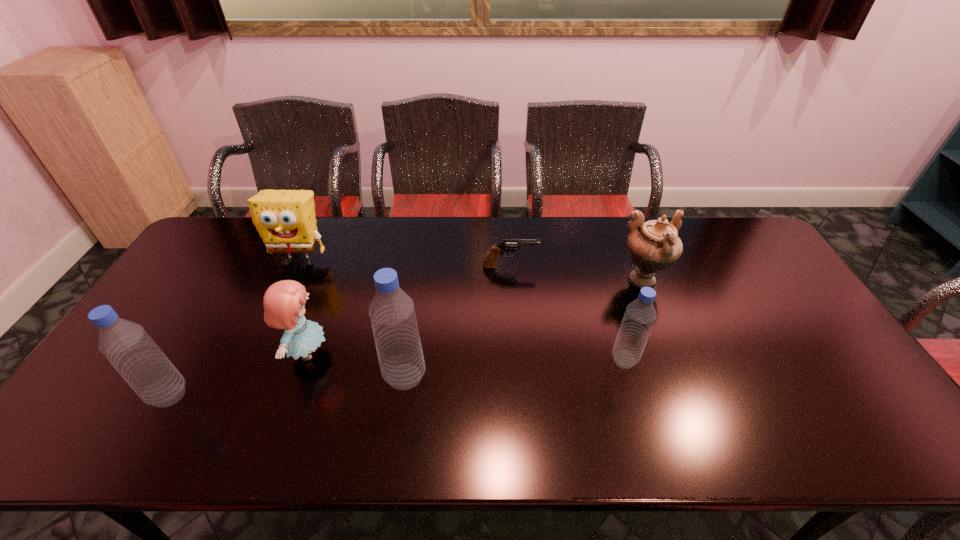
You are a GUI agent. You are given a task and a screenshot of the screen. Output one action in this format:
    pyautogui.click(x=<x>, y=<y>)
    Task: Click on the vacant space that satisfies the following two spatial constraints: 1. on the back side of the fourth object from right to left; 2. on the front-facing side of the doll
    The height and width of the screenshot is (540, 960).
    Given the screenshot: What is the action you would take?
    pyautogui.click(x=408, y=353)

Find the location of a particular element. The width and height of the screenshot is (960, 540). free location that satisfies the following two spatial constraints: 1. on the front-facing side of the doll; 2. on the back side of the fourth object from left to right is located at coordinates (299, 377).